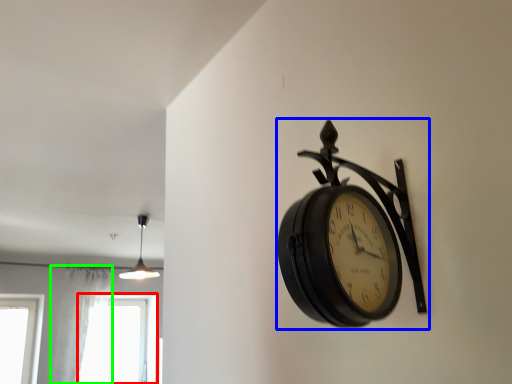
Question: Which is nearer to the window (highlighted by a red box)? wall clock (highlighted by a blue box) or curtain (highlighted by a green box).

Choices:
 (A) wall clock
 (B) curtain

Answer: (B)